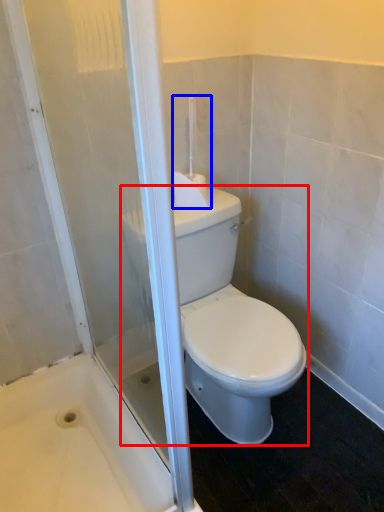
Question: Which of the following is the farthest to the observer, porcelain (highlighted by a red box) or towel bar (highlighted by a blue box)?

Choices:
 (A) porcelain
 (B) towel bar

Answer: (B)